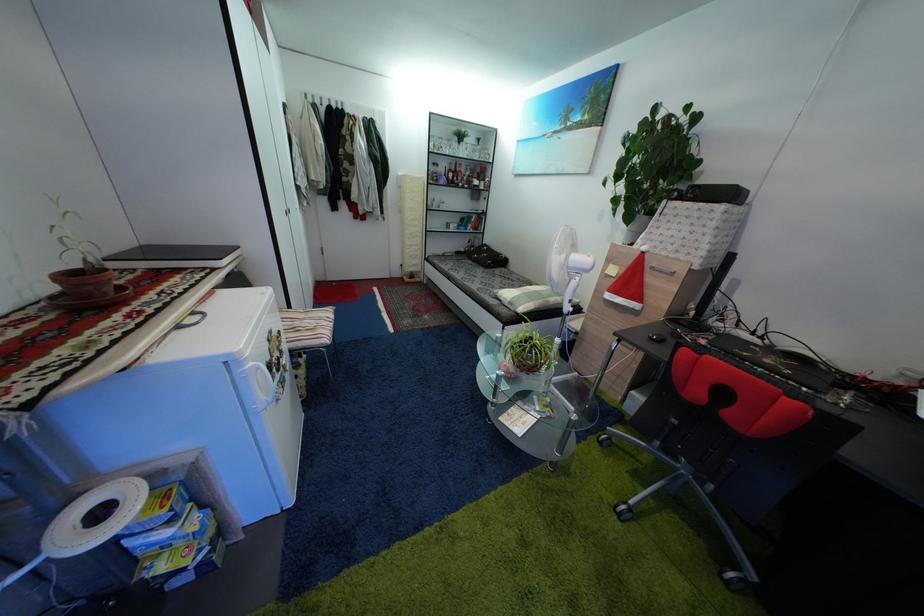
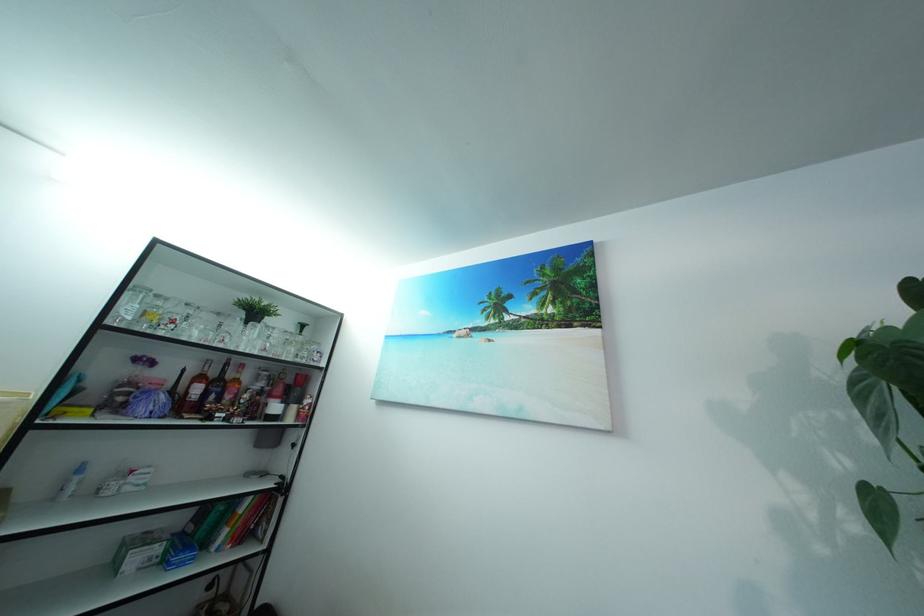
The point at (470, 159) is marked in the first image. Where is the corresponding point in the second image?

(257, 347)